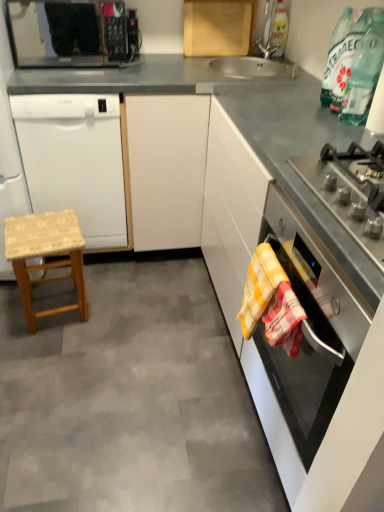
Locate an element on the screen. free space in front of woven wood stool at lower left is located at coordinates (49, 351).